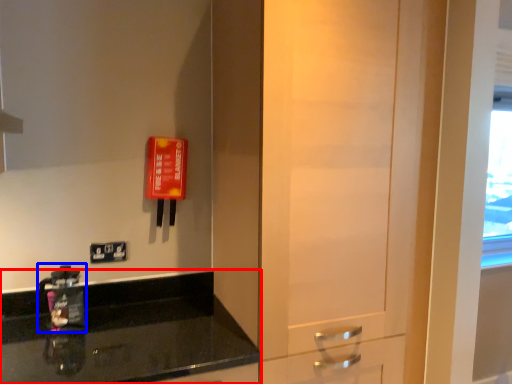
Question: Among these objects, which one is farthest to the camera, countertop (highlighted by a red box) or appliance (highlighted by a blue box)?

Choices:
 (A) countertop
 (B) appliance

Answer: (B)